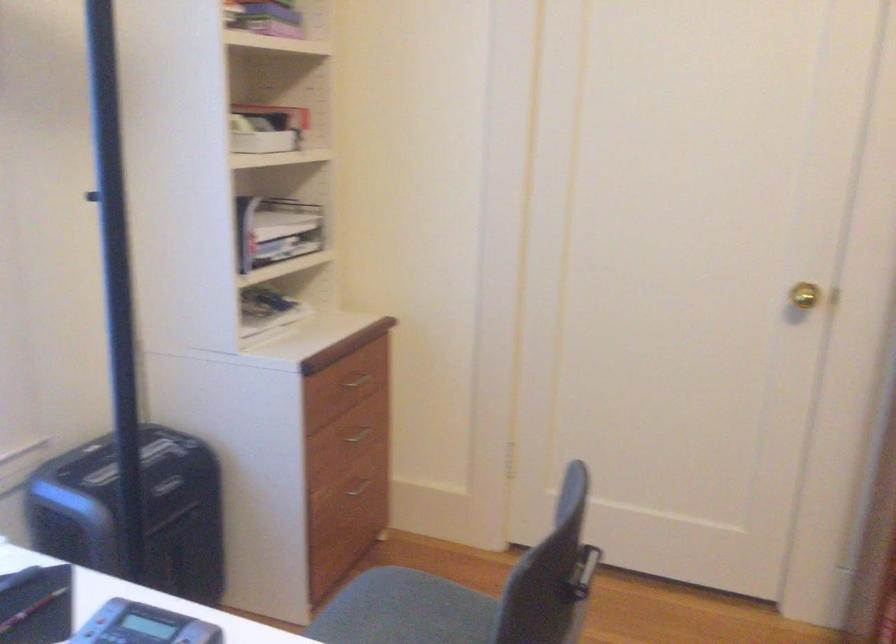
Image resolution: width=896 pixels, height=644 pixels. What do you see at coordinates (405, 611) in the screenshot? I see `the chair sitting surface` at bounding box center [405, 611].